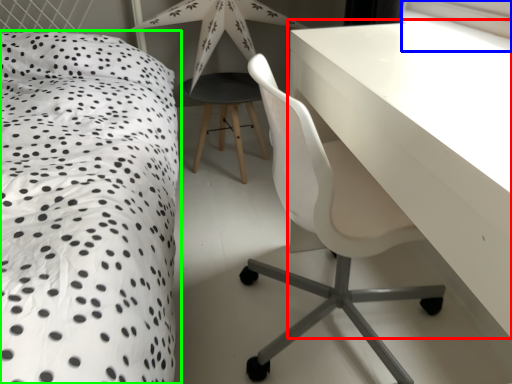
Question: Based on their relative distances, which object is nearer to table (highlighted by a red box)? Choose from window screen (highlighted by a blue box) and bed (highlighted by a green box).

Choices:
 (A) window screen
 (B) bed

Answer: (B)